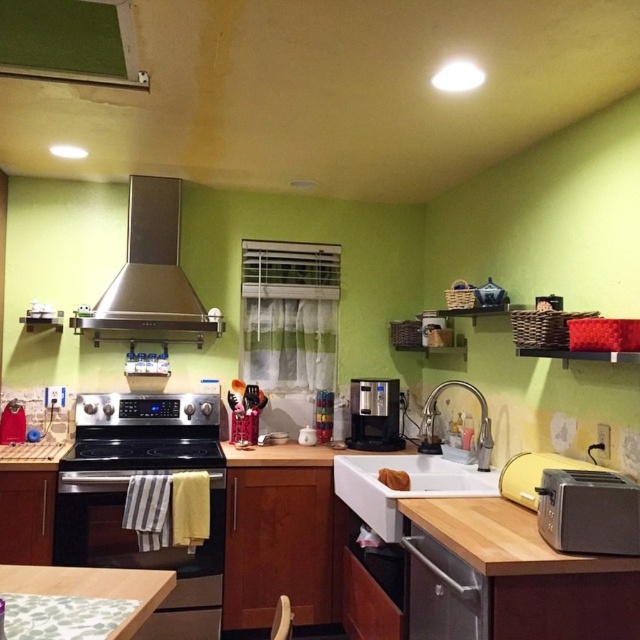
Can you confirm if silver metallic toaster at lower right is smaller than white matte sink at center?

Indeed, silver metallic toaster at lower right has a smaller size compared to white matte sink at center.

What do you see at coordinates (588, 512) in the screenshot?
I see `silver metallic toaster at lower right` at bounding box center [588, 512].

Where is `silver metallic toaster at lower right`? The width and height of the screenshot is (640, 640). silver metallic toaster at lower right is located at coordinates (588, 512).

Looking at this image, how much distance is there between black stainless steel oven at lower left and satin black coffee machine at center?

black stainless steel oven at lower left is 3.63 feet from satin black coffee machine at center.

Can you confirm if black stainless steel oven at lower left is taller than satin black coffee machine at center?

Indeed, black stainless steel oven at lower left has a greater height compared to satin black coffee machine at center.

You are a GUI agent. You are given a task and a screenshot of the screen. Output one action in this format:
    pyautogui.click(x=<x>, y=<y>)
    Task: Click on the black stainless steel oven at lower left
    The height and width of the screenshot is (640, 640).
    Given the screenshot: What is the action you would take?
    pyautogui.click(x=141, y=552)

Identify the location of black stainless steel oven at lower left. (141, 552).

Who is shorter, silver metallic toaster at lower right or satin black coffee machine at center?

silver metallic toaster at lower right

Does silver metallic toaster at lower right appear over satin black coffee machine at center?

Correct, silver metallic toaster at lower right is located above satin black coffee machine at center.

Where is `silver metallic toaster at lower right`? silver metallic toaster at lower right is located at coordinates (588, 512).

At what (x,y) coordinates should I click in order to perform the action: click on silver metallic toaster at lower right. Please return your answer as a coordinate pair (x, y). The image size is (640, 640). Looking at the image, I should click on (588, 512).